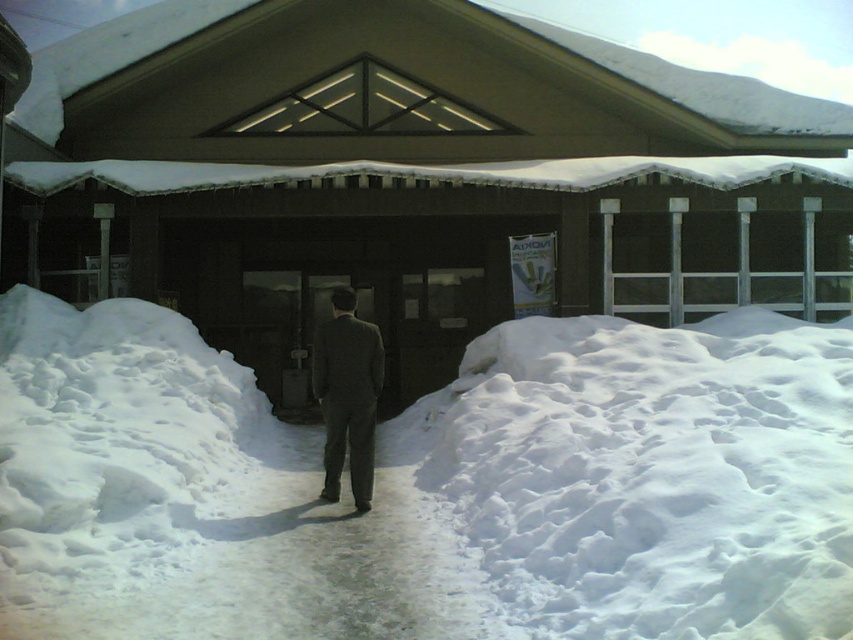
You are a photographer trying to capture a wide shot of the dark gray suit at center and the white fluffy snow at center. Based on the scene description, which object occupies more horizontal space in the image?

The white fluffy snow at center occupies more horizontal space in the image because its width is larger than that of the dark gray suit at center.

You are standing at the entrance of the building and want to determine the relative positions of two points marked in the image. Which point is closer to you, point (113,323) or point (381,188)?

Point (113,323) is closer to the viewer than point (381,188).

You are standing at the entrance of the building and want to determine which of the two points, point (254, 280) or point (337, 412), is closer to you. Based on the image, which point is nearer?

Point (254, 280) is closer to you because it is further to the viewer than point (337, 412).